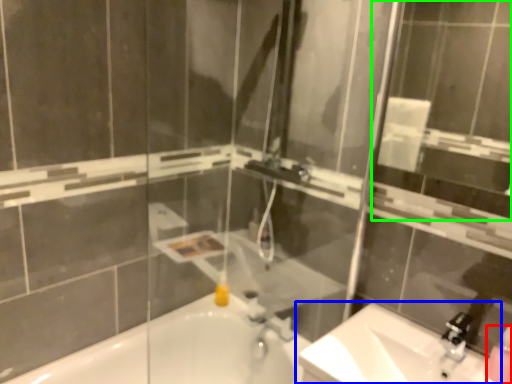
Question: Estimate the real-world distances between objects in this image. Which object is farther from soap dispenser (highlighted by a red box), sink (highlighted by a blue box) or mirror (highlighted by a green box)?

Choices:
 (A) sink
 (B) mirror

Answer: (B)